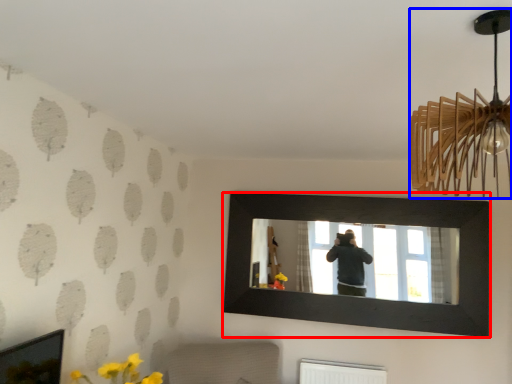
Question: Which point is closer to the camera, picture frame (highlighted by a red box) or lamp (highlighted by a blue box)?

Choices:
 (A) picture frame
 (B) lamp

Answer: (B)